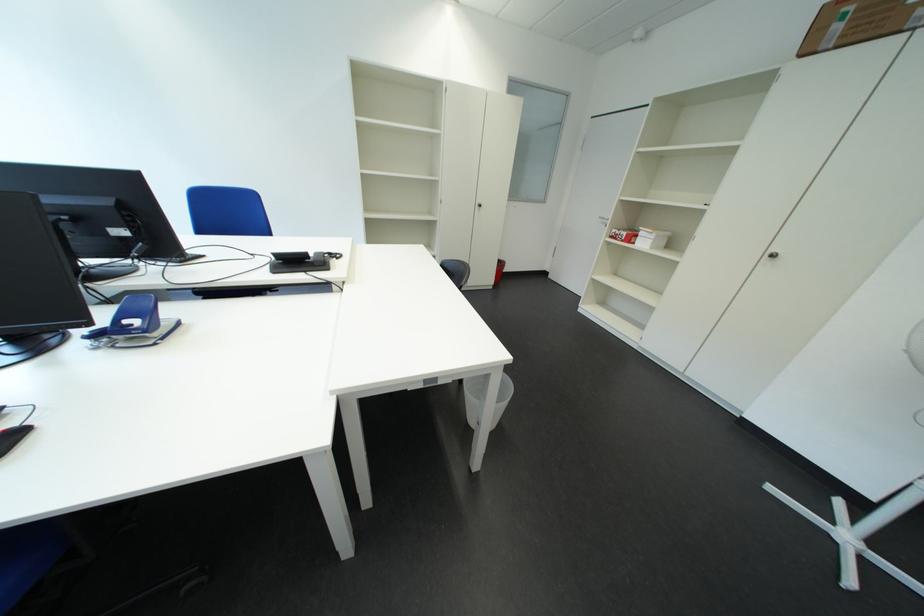
Locate an element on the screen. This screenshot has width=924, height=616. telephone handset is located at coordinates (327, 257).